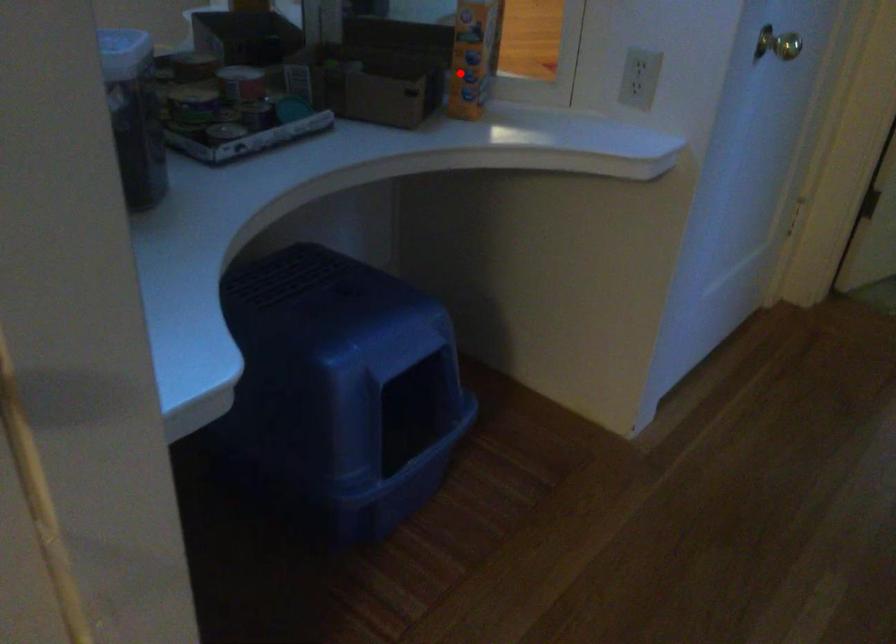
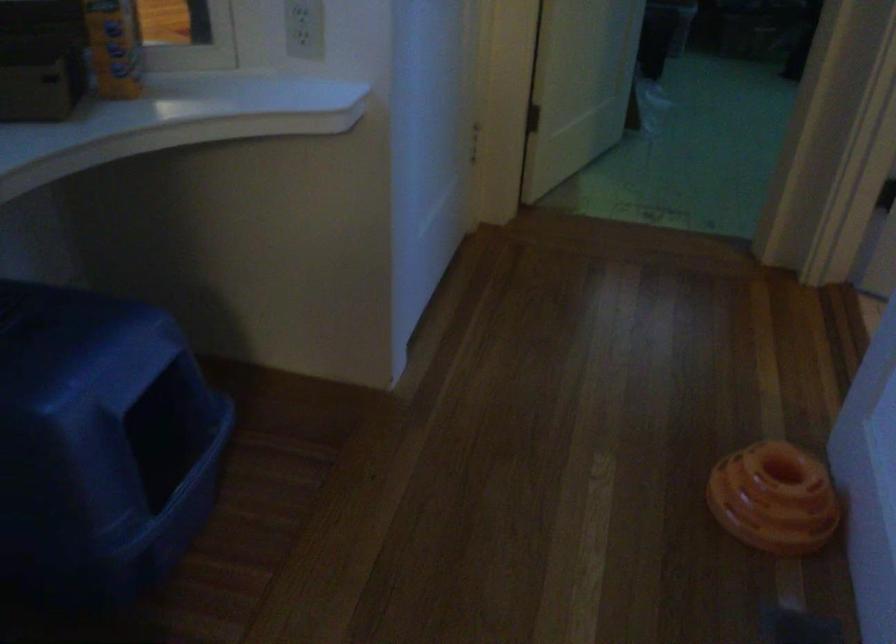
Question: I am providing you with two images of the same scene from different viewpoints. Given a red point in image1, look at the same physical point in image2. Is it:

Choices:
 (A) Closer to the viewpoint
 (B) Farther from the viewpoint

Answer: (A)